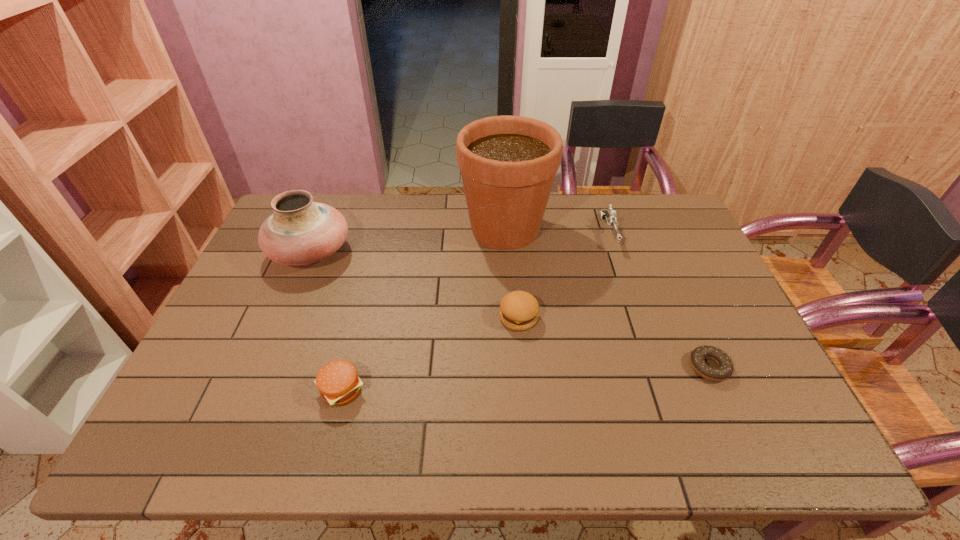
Where is `object positioned at the left edge`? This screenshot has height=540, width=960. object positioned at the left edge is located at coordinates (300, 231).

The height and width of the screenshot is (540, 960). I want to click on object that is at the right edge, so click(x=724, y=370).

Identify the location of object present at the far left corner. This screenshot has height=540, width=960. (300, 231).

The height and width of the screenshot is (540, 960). In order to click on free region at the far edge in this screenshot , I will do `click(594, 213)`.

Locate an element on the screen. The image size is (960, 540). blank area at the near edge is located at coordinates (499, 426).

This screenshot has height=540, width=960. What are the coordinates of `free region at the left edge of the desktop` in the screenshot? It's located at (219, 401).

The width and height of the screenshot is (960, 540). What are the coordinates of `vacant space at the near left corner` in the screenshot? It's located at (212, 424).

Where is `vacant area at the far right corner`? vacant area at the far right corner is located at coordinates (682, 213).

Find the location of a particular element. Image resolution: width=960 pixels, height=540 pixels. free space between the third nearest object and the tallest object is located at coordinates (512, 273).

Where is `free space between the right hamburger and the leftmost object`? The height and width of the screenshot is (540, 960). free space between the right hamburger and the leftmost object is located at coordinates (415, 285).